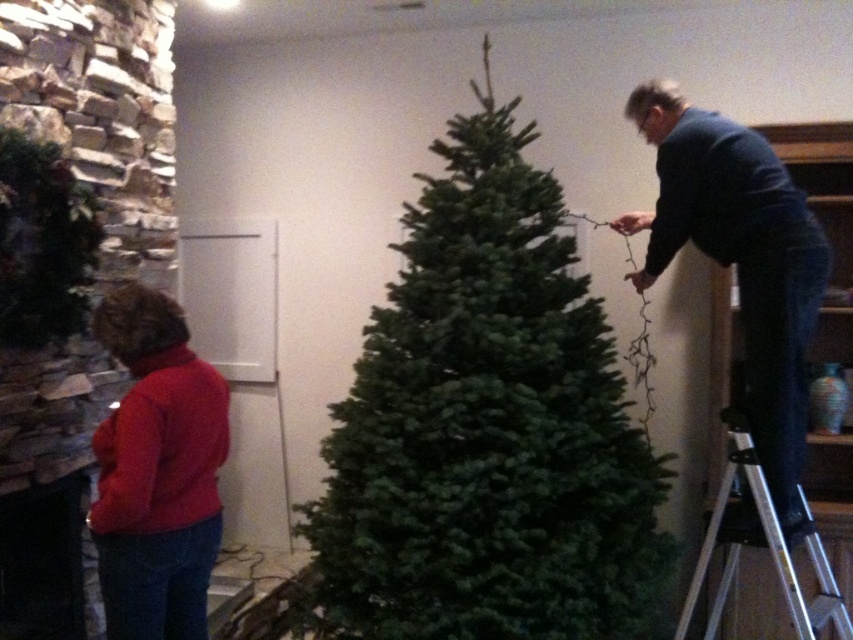
Describe the element at coordinates (488, 428) in the screenshot. I see `green matte christmas tree at center` at that location.

Can you confirm if green matte christmas tree at center is wider than silver metallic ladder at right?

Yes.

Describe the element at coordinates (488, 428) in the screenshot. I see `green matte christmas tree at center` at that location.

Identify the location of green matte christmas tree at center. (488, 428).

Does dark blue suit at right have a larger size compared to red matte sweater at lower left?

Correct, dark blue suit at right is larger in size than red matte sweater at lower left.

Does dark blue suit at right appear on the left side of red matte sweater at lower left?

In fact, dark blue suit at right is to the right of red matte sweater at lower left.

Is point (734, 248) closer to viewer compared to point (184, 374)?

No.

You are a GUI agent. You are given a task and a screenshot of the screen. Output one action in this format:
    pyautogui.click(x=<x>, y=<y>)
    Task: Click on the dark blue suit at right
    This screenshot has width=853, height=640.
    Given the screenshot: What is the action you would take?
    pyautogui.click(x=740, y=260)

Can you confirm if green matte christmas tree at center is bigger than red matte sweater at lower left?

Yes.

Describe the element at coordinates (488, 428) in the screenshot. This screenshot has height=640, width=853. I see `green matte christmas tree at center` at that location.

Does point (424, 493) come closer to viewer compared to point (120, 516)?

No, (424, 493) is further to viewer.

Find the location of `green matte christmas tree at center`. green matte christmas tree at center is located at coordinates (488, 428).